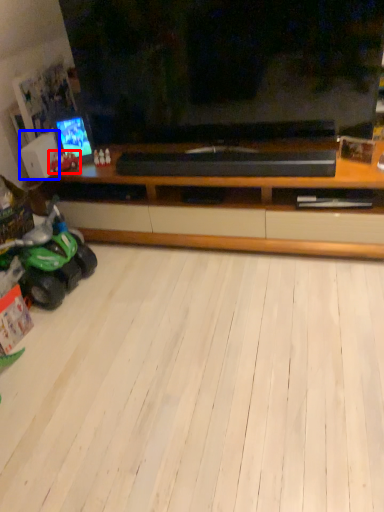
Question: Which object appears farthest to the camera in this image, land vehicle (highlighted by a red box) or speaker (highlighted by a blue box)?

Choices:
 (A) land vehicle
 (B) speaker

Answer: (A)